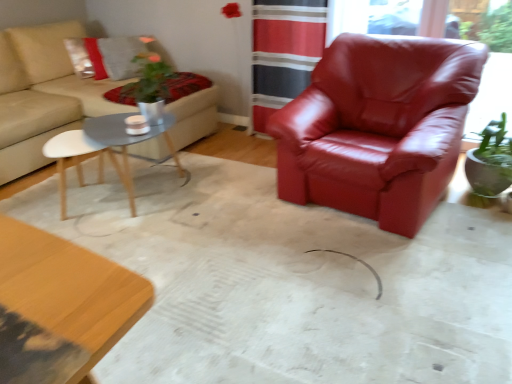
At what (x,y) coordinates should I click in order to perform the action: click on free location in front of satin red armchair at center. Please return your answer as a coordinate pair (x, y). The image size is (512, 384). Looking at the image, I should click on (372, 284).